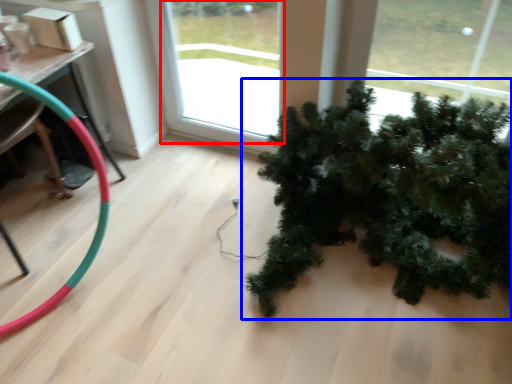
Question: Which of the following is the closest to the observer, window (highlighted by a red box) or houseplant (highlighted by a blue box)?

Choices:
 (A) window
 (B) houseplant

Answer: (B)